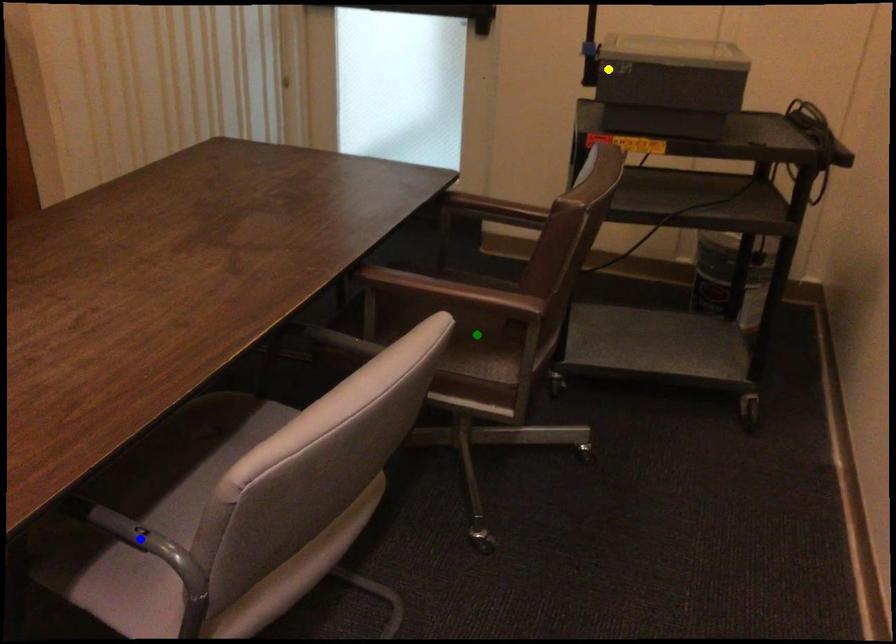
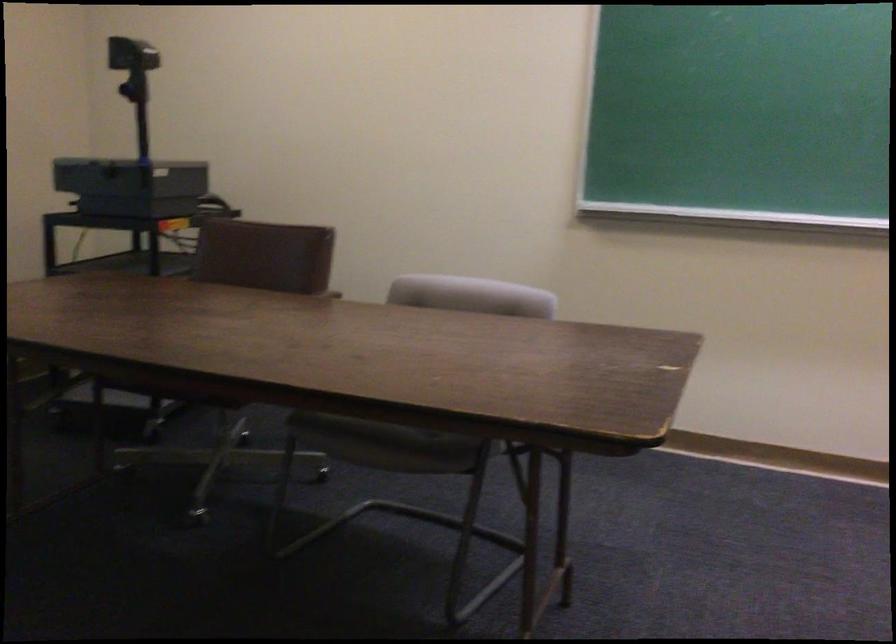
I am providing you with two images of the same scene from different viewpoints. Three points are marked in image1. Which point corresponds to a part or object that is occluded in image2?In image1, three points are marked. Which of them correspond to a part or object that is occluded in image2?Among the three points shown in image1, which one corresponds to a part or object that is no longer visible due to occlusion in image2?

Invisible in image2: blue point, green point.